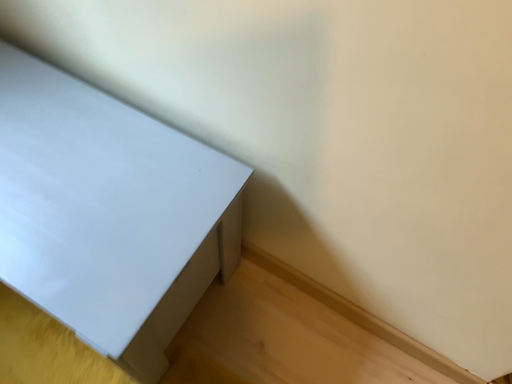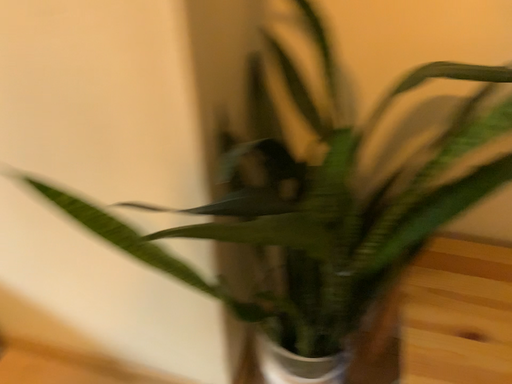
Question: How did the camera likely rotate when shooting the video?

Choices:
 (A) rotated upward
 (B) rotated downward

Answer: (A)